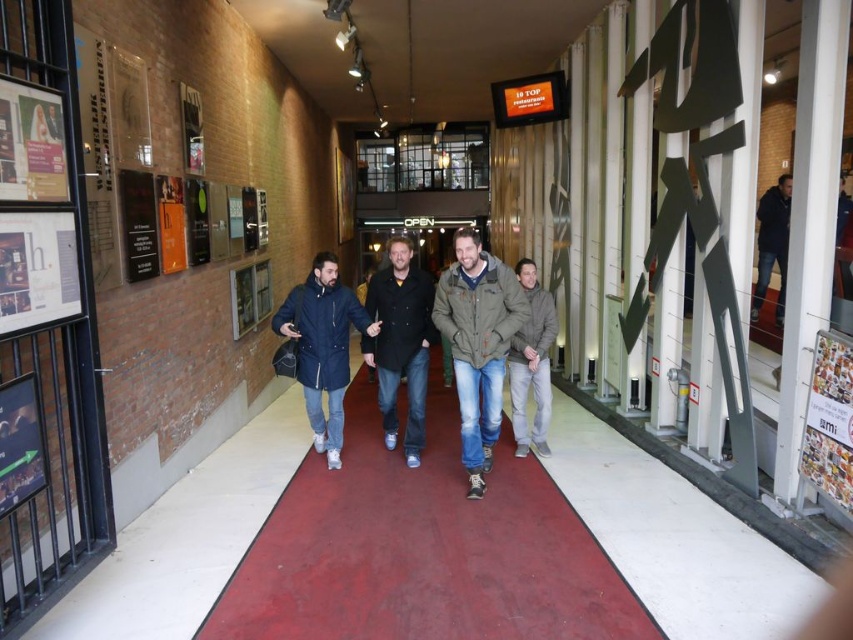
Question: Which point is closer to the camera taking this photo?

Choices:
 (A) (527, 371)
 (B) (561, 538)
 (C) (515, 316)
 (D) (766, 218)

Answer: (B)

Question: Does rubberized red carpet at center have a lesser width compared to dark blue jeans at right?

Choices:
 (A) yes
 (B) no

Answer: (B)

Question: Which of the following is the closest to the observer?

Choices:
 (A) matte black coat at center
 (B) dark blue wool coat at center

Answer: (A)

Question: Does gray woolen sweater at center appear on the right side of dark blue jeans at right?

Choices:
 (A) no
 (B) yes

Answer: (A)

Question: Based on their relative distances, which object is nearer to the dark blue wool coat at center?

Choices:
 (A) matte black coat at center
 (B) green textured jacket at center

Answer: (A)

Question: Can you confirm if dark blue wool coat at center is thinner than dark blue jeans at right?

Choices:
 (A) yes
 (B) no

Answer: (A)